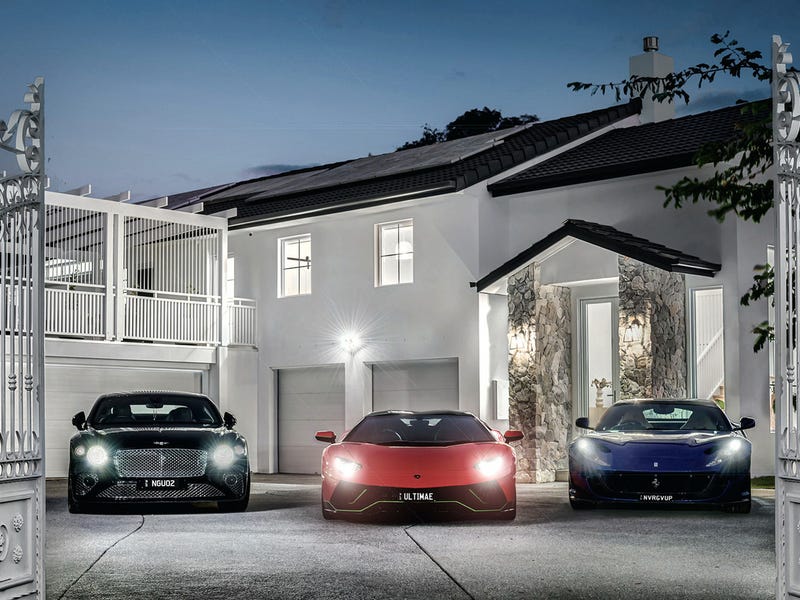
Identify the location of right top window. This screenshot has height=600, width=800. (390, 238).